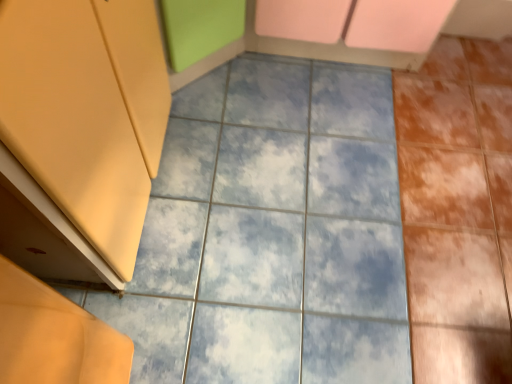
Question: Is blue marble tile at center smaller than matte yellow cabinet at left?

Choices:
 (A) no
 (B) yes

Answer: (B)

Question: Is blue marble tile at center taller than matte yellow cabinet at left?

Choices:
 (A) no
 (B) yes

Answer: (A)

Question: Is blue marble tile at center surrounding matte yellow cabinet at left?

Choices:
 (A) no
 (B) yes

Answer: (A)

Question: Is blue marble tile at center aimed at matte yellow cabinet at left?

Choices:
 (A) yes
 (B) no

Answer: (B)

Question: From a real-world perspective, is blue marble tile at center below matte yellow cabinet at left?

Choices:
 (A) no
 (B) yes

Answer: (B)

Question: Can you confirm if blue marble tile at center is bigger than matte yellow cabinet at left?

Choices:
 (A) yes
 (B) no

Answer: (B)

Question: Can you confirm if matte yellow cabinet at left is positioned to the right of blue marble tile at center?

Choices:
 (A) no
 (B) yes

Answer: (A)

Question: Considering the relative sizes of matte yellow cabinet at left and blue marble tile at center in the image provided, is matte yellow cabinet at left thinner than blue marble tile at center?

Choices:
 (A) yes
 (B) no

Answer: (A)

Question: Does matte yellow cabinet at left lie behind blue marble tile at center?

Choices:
 (A) no
 (B) yes

Answer: (A)

Question: Can you confirm if matte yellow cabinet at left is shorter than blue marble tile at center?

Choices:
 (A) yes
 (B) no

Answer: (B)

Question: Are matte yellow cabinet at left and blue marble tile at center beside each other?

Choices:
 (A) no
 (B) yes

Answer: (A)

Question: Is matte yellow cabinet at left not inside blue marble tile at center?

Choices:
 (A) no
 (B) yes

Answer: (B)

Question: From a real-world perspective, relative to blue marble tile at center, is matte yellow cabinet at left vertically above or below?

Choices:
 (A) below
 (B) above

Answer: (B)